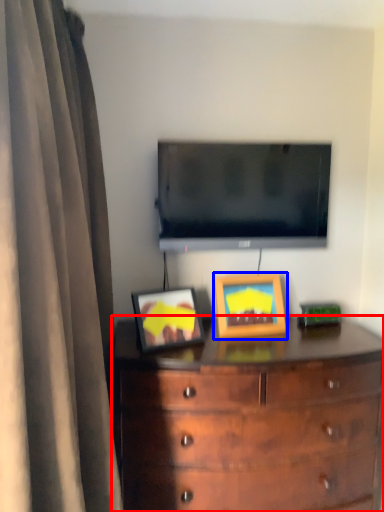
Question: Which of the following is the closest to the observer, chest of drawers (highlighted by a red box) or picture frame (highlighted by a blue box)?

Choices:
 (A) chest of drawers
 (B) picture frame

Answer: (A)